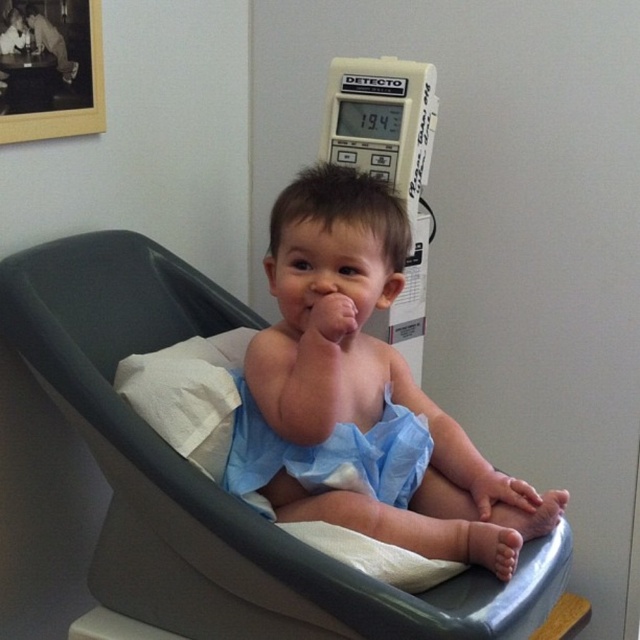
You are a nurse preparing to weigh a child on the DETECTO scale. The child is currently sitting on the blue fabric feeding chair at center and wearing the light blue cloth diaper at center. To move the child to the scale, you need to know the distance between the feeding chair and the diaper. Is the distance between them sufficient for you to safely lift and transfer the child without the diaper slipping off? Please state the distance and your conclusion.

The distance between the blue fabric feeding chair at center and the light blue cloth diaper at center is 8.17 inches. This distance is sufficient for a nurse to safely lift and transfer the child without the diaper slipping off, as 8.17 inches provides enough space to maneuver while maintaining stability.

You are a medical assistant trying to locate two points marked on the wall behind the child. The first point is at coordinates point (243,502) and the second at point (387,484). Which point is closer to you?

The point at coordinates point (243,502) is closer to the viewer than point (387,484).

You are a nurse preparing to weigh a child using the DETECTO scale. You need to move the blue fabric feeding chair at center and the blue fabric cloth at center out of the way. Which object should you move first to ensure the path to the scale is clear?

The blue fabric feeding chair at center is in front of the blue fabric cloth at center. Therefore, you should move the blue fabric feeding chair at center first to clear the path to the scale.